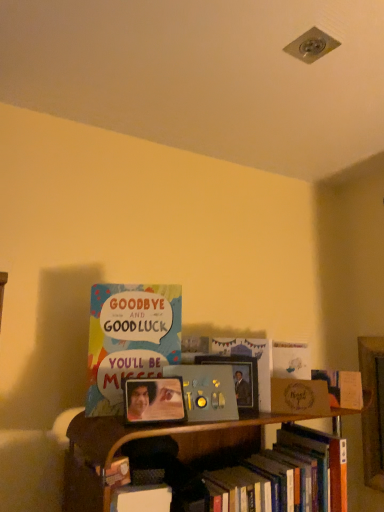
The height and width of the screenshot is (512, 384). Describe the element at coordinates (285, 476) in the screenshot. I see `hardcover book at lower right, the fifth book positioned from the top` at that location.

This screenshot has width=384, height=512. Describe the element at coordinates (206, 391) in the screenshot. I see `metallic silver remote control at center, which is the 3th book in top-to-bottom order` at that location.

Identify the location of matte gold card at right. (299, 397).

The width and height of the screenshot is (384, 512). Describe the element at coordinates (129, 339) in the screenshot. I see `multicolored paper card at center, marked as the fifth book in a bottom-to-top arrangement` at that location.

This screenshot has height=512, width=384. Describe the element at coordinates (154, 400) in the screenshot. I see `matte wooden picture frame at center` at that location.

How much space does wooden plaque at center, marked as the fourth book in a top-to-bottom arrangement, occupy vertically?

It is 11.78 centimeters.

The width and height of the screenshot is (384, 512). Find the location of `hardcover book at lower right, the 1th book from the bottom`. hardcover book at lower right, the 1th book from the bottom is located at coordinates (285, 476).

Is wooden plaque at center, marked as the fourth book in a top-to-bottom arrangement, positioned with its back to white matte card at upper center, placed as the 4th book when sorted from bottom to top?

No, wooden plaque at center, marked as the fourth book in a top-to-bottom arrangement,'s orientation is not away from white matte card at upper center, placed as the 4th book when sorted from bottom to top.

From the image's perspective, which is below, wooden plaque at center, which is counted as the second book, starting from the bottom, or white matte card at upper center, which ranks as the second book in top-to-bottom order?

From the image's view, wooden plaque at center, which is counted as the second book, starting from the bottom, is below.

Considering the relative positions of wooden plaque at center, marked as the fourth book in a top-to-bottom arrangement, and white matte card at upper center, which ranks as the second book in top-to-bottom order, in the image provided, is wooden plaque at center, marked as the fourth book in a top-to-bottom arrangement, to the right of white matte card at upper center, which ranks as the second book in top-to-bottom order, from the viewer's perspective?

Yes, wooden plaque at center, marked as the fourth book in a top-to-bottom arrangement, is to the right of white matte card at upper center, which ranks as the second book in top-to-bottom order.

From a real-world perspective, between wooden plaque at center, marked as the fourth book in a top-to-bottom arrangement, and white matte card at upper center, placed as the 4th book when sorted from bottom to top, who is vertically lower?

wooden plaque at center, marked as the fourth book in a top-to-bottom arrangement.

Does matte gold card at right lie in front of metallic silver remote control at center, which is the 3th book in bottom-to-top order?

No, matte gold card at right is further to the viewer.

How many degrees apart are the facing directions of matte gold card at right and metallic silver remote control at center, which is the 3th book in bottom-to-top order?

matte gold card at right and metallic silver remote control at center, which is the 3th book in bottom-to-top order, are facing 25.4 degrees away from each other.

Considering the positions of objects matte gold card at right and metallic silver remote control at center, which is the 3th book in bottom-to-top order, in the image provided, who is more to the right, matte gold card at right or metallic silver remote control at center, which is the 3th book in bottom-to-top order,?

matte gold card at right is more to the right.

Is point (284, 361) more distant than point (325, 376)?

That is True.

Consider the image. From the image's perspective, would you say white matte card at upper center, which ranks as the second book in top-to-bottom order, is shown under wooden plaque at center, which is counted as the second book, starting from the bottom?

No.

Does white matte card at upper center, which ranks as the second book in top-to-bottom order, have a smaller size compared to wooden plaque at center, which is counted as the second book, starting from the bottom?

Yes, white matte card at upper center, which ranks as the second book in top-to-bottom order, is smaller than wooden plaque at center, which is counted as the second book, starting from the bottom.

What's the angular difference between white matte card at upper center, placed as the 4th book when sorted from bottom to top, and wooden plaque at center, marked as the fourth book in a top-to-bottom arrangement,'s facing directions?

white matte card at upper center, placed as the 4th book when sorted from bottom to top, and wooden plaque at center, marked as the fourth book in a top-to-bottom arrangement, are facing 19.5 degrees away from each other.

Is matte wooden picture frame at center located outside hardcover book at lower right, the fifth book positioned from the top?

Yes.

Is point (156, 383) less distant than point (260, 507)?

Yes, point (156, 383) is closer to viewer.

Is matte wooden picture frame at center far away from hardcover book at lower right, the 1th book from the bottom?

No, matte wooden picture frame at center is not far from hardcover book at lower right, the 1th book from the bottom.

Can you confirm if metallic silver remote control at center, which is the 3th book in bottom-to-top order, is smaller than hardcover book at lower right, the 1th book from the bottom?

Yes, metallic silver remote control at center, which is the 3th book in bottom-to-top order, is smaller than hardcover book at lower right, the 1th book from the bottom.

Is metallic silver remote control at center, which is the 3th book in bottom-to-top order, next to hardcover book at lower right, the 1th book from the bottom?

There is a gap between metallic silver remote control at center, which is the 3th book in bottom-to-top order, and hardcover book at lower right, the 1th book from the bottom.

Is metallic silver remote control at center, which is the 3th book in bottom-to-top order, inside the boundaries of hardcover book at lower right, the fifth book positioned from the top, or outside?

The correct answer is: outside.

Looking at this image, between metallic silver remote control at center, which is the 3th book in top-to-bottom order, and wooden plaque at center, which is counted as the second book, starting from the bottom, which one has smaller width?

Thinner between the two is metallic silver remote control at center, which is the 3th book in top-to-bottom order.

From the image's perspective, is metallic silver remote control at center, which is the 3th book in bottom-to-top order, above or below wooden plaque at center, marked as the fourth book in a top-to-bottom arrangement?

metallic silver remote control at center, which is the 3th book in bottom-to-top order, is above wooden plaque at center, marked as the fourth book in a top-to-bottom arrangement.

How much distance is there between metallic silver remote control at center, which is the 3th book in bottom-to-top order, and wooden plaque at center, marked as the fourth book in a top-to-bottom arrangement?

metallic silver remote control at center, which is the 3th book in bottom-to-top order, and wooden plaque at center, marked as the fourth book in a top-to-bottom arrangement, are 13.79 inches apart.

What's the angular difference between metallic silver remote control at center, which is the 3th book in top-to-bottom order, and wooden plaque at center, marked as the fourth book in a top-to-bottom arrangement,'s facing directions?

They differ by 52.2 degrees in their facing directions.

From the image's perspective, is matte gold card at right above hardcover book at lower right, the fifth book positioned from the top?

Indeed, from the image's perspective, matte gold card at right is shown above hardcover book at lower right, the fifth book positioned from the top.

Is matte gold card at right positioned beyond the bounds of hardcover book at lower right, the fifth book positioned from the top?

Absolutely, matte gold card at right is external to hardcover book at lower right, the fifth book positioned from the top.

This screenshot has width=384, height=512. In order to click on paperback book located on the right of hardcover book at lower right, the fifth book positioned from the top in this screenshot , I will do `click(299, 397)`.

The image size is (384, 512). I want to click on the 2nd book above the wooden plaque at center, marked as the fourth book in a top-to-bottom arrangement (from the image's perspective), so click(x=291, y=360).

Locate an element on the screen. The height and width of the screenshot is (512, 384). book that is the 2nd one when counting leftward from the matte gold card at right is located at coordinates (206, 391).

Estimate the real-world distances between objects in this image. Which object is closer to white matte card at upper center, which ranks as the second book in top-to-bottom order, matte wooden picture frame at center or metallic silver remote control at center, which is the 3th book in bottom-to-top order?

metallic silver remote control at center, which is the 3th book in bottom-to-top order, lies closer to white matte card at upper center, which ranks as the second book in top-to-bottom order, than the other object.

Considering their positions, is white matte card at upper center, placed as the 4th book when sorted from bottom to top, positioned further to metallic silver remote control at center, which is the 3th book in top-to-bottom order, than multicolored paper card at center, positioned as the first book in top-to-bottom order?

white matte card at upper center, placed as the 4th book when sorted from bottom to top, is further to metallic silver remote control at center, which is the 3th book in top-to-bottom order.

Considering their positions, is matte gold card at right positioned closer to hardcover book at lower right, the fifth book positioned from the top, than wooden plaque at center, which is counted as the second book, starting from the bottom?

matte gold card at right.

From the image, which object appears to be farther from matte gold card at right, hardcover book at lower right, the 1th book from the bottom, or wooden plaque at center, marked as the fourth book in a top-to-bottom arrangement?

Based on the image, hardcover book at lower right, the 1th book from the bottom, appears to be further to matte gold card at right.

Considering their positions, is matte wooden picture frame at center positioned closer to hardcover book at lower right, the 1th book from the bottom, than multicolored paper card at center, positioned as the first book in top-to-bottom order?

Based on the image, matte wooden picture frame at center appears to be nearer to hardcover book at lower right, the 1th book from the bottom.

Consider the image. Looking at the image, which one is located closer to matte wooden picture frame at center, wooden plaque at center, marked as the fourth book in a top-to-bottom arrangement, or metallic silver remote control at center, which is the 3th book in top-to-bottom order?

metallic silver remote control at center, which is the 3th book in top-to-bottom order, is positioned closer to the anchor matte wooden picture frame at center.

When comparing their distances from matte gold card at right, does hardcover book at lower right, the fifth book positioned from the top, or metallic silver remote control at center, which is the 3th book in top-to-bottom order, seem further?

Among the two, hardcover book at lower right, the fifth book positioned from the top, is located further to matte gold card at right.

Looking at the image, which one is located further to wooden plaque at center, which is counted as the second book, starting from the bottom, matte wooden picture frame at center or metallic silver remote control at center, which is the 3th book in bottom-to-top order?

Based on the image, matte wooden picture frame at center appears to be further to wooden plaque at center, which is counted as the second book, starting from the bottom.

At what (x,y) coordinates should I click in order to perform the action: click on picture frame situated between multicolored paper card at center, positioned as the first book in top-to-bottom order, and metallic silver remote control at center, which is the 3th book in top-to-bottom order, from left to right. Please return your answer as a coordinate pair (x, y). Looking at the image, I should click on (154, 400).

This screenshot has height=512, width=384. I want to click on book between matte gold card at right and wooden plaque at center, marked as the fourth book in a top-to-bottom arrangement, from left to right, so click(291, 360).

Find the location of a particular element. The image size is (384, 512). picture frame between multicolored paper card at center, positioned as the first book in top-to-bottom order, and hardcover book at lower right, the fifth book positioned from the top, vertically is located at coordinates (154, 400).

Find the location of `paperback book between metallic silver remote control at center, which is the 3th book in top-to-bottom order, and hardcover book at lower right, the fifth book positioned from the top, vertically`. paperback book between metallic silver remote control at center, which is the 3th book in top-to-bottom order, and hardcover book at lower right, the fifth book positioned from the top, vertically is located at coordinates (299, 397).